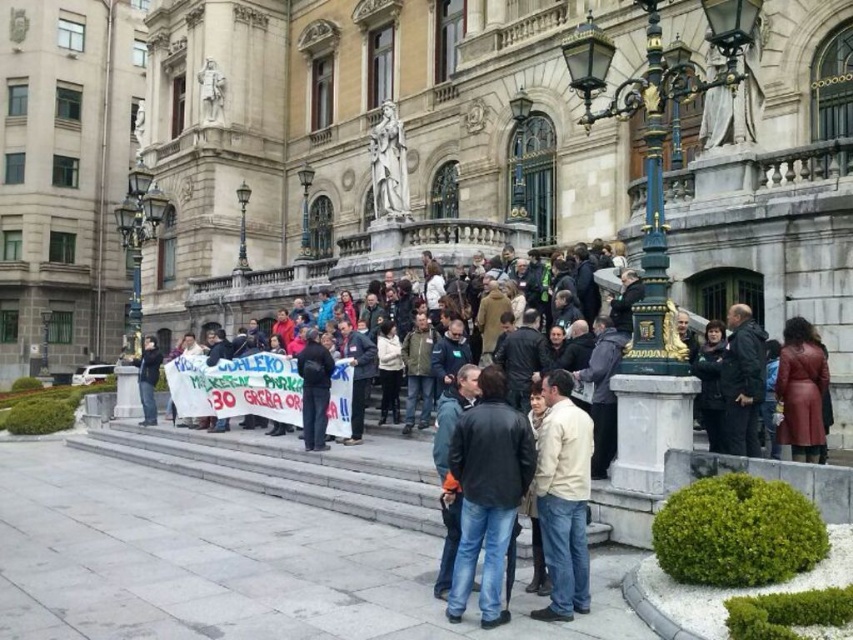
Question: Which of these objects is positioned farthest from the dark blue leather jacket at center?

Choices:
 (A) jeans at lower left
 (B) leather coat at center
 (C) light brown leather jacket at center

Answer: (A)

Question: Is leather coat at center positioned before jeans at lower left?

Choices:
 (A) no
 (B) yes

Answer: (B)

Question: Which of these objects is positioned farthest from the jeans at lower left?

Choices:
 (A) leather coat at center
 (B) light brown leather jacket at center

Answer: (A)

Question: Which of the following is the farthest from the observer?

Choices:
 (A) (556, 406)
 (B) (489, 412)

Answer: (A)

Question: Is dark blue leather jacket at center smaller than leather coat at center?

Choices:
 (A) no
 (B) yes

Answer: (A)

Question: Is light brown leather jacket at center to the right of leather coat at center from the viewer's perspective?

Choices:
 (A) yes
 (B) no

Answer: (B)